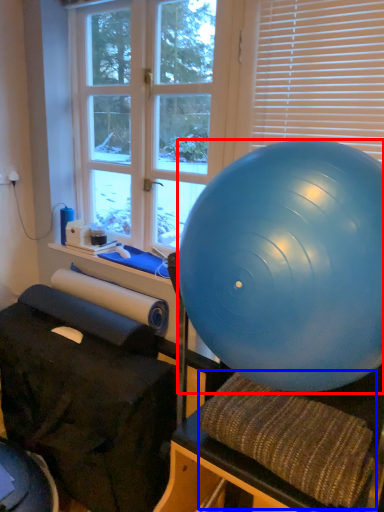
Question: Which object appears farthest to the camera in this image, ball (highlighted by a red box) or bean bag chair (highlighted by a blue box)?

Choices:
 (A) ball
 (B) bean bag chair

Answer: (B)